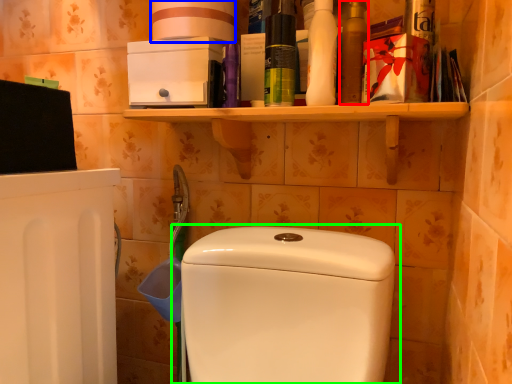
Question: Estimate the real-world distances between objects in this image. Which object is closer to mouthwash (highlighted by a red box), toilet paper (highlighted by a blue box) or toilet (highlighted by a green box)?

Choices:
 (A) toilet paper
 (B) toilet

Answer: (A)